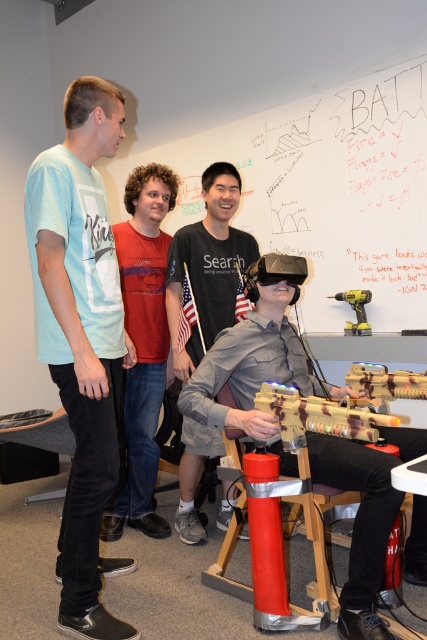
Question: Which point is closer to the camera taking this photo?

Choices:
 (A) (161, 342)
 (B) (219, 173)
 (C) (373, 429)
 (D) (90, 410)

Answer: (C)

Question: Which point is closer to the camera taking this photo?

Choices:
 (A) (148, 234)
 (B) (281, 412)
 (C) (353, 326)
 (D) (187, 237)

Answer: (B)

Question: Can you confirm if light blue t-shirt at left is thinner than red cotton shirt at center?

Choices:
 (A) no
 (B) yes

Answer: (A)

Question: Estimate the real-world distances between objects in this image. Which object is farther from the light blue t-shirt at left?

Choices:
 (A) camouflage fabric gun at center
 (B) matte gray shirt at center
 (C) metallic drill at center

Answer: (C)

Question: Is light blue t-shirt at left smaller than metallic drill at center?

Choices:
 (A) yes
 (B) no

Answer: (B)

Question: Is light blue t-shirt at left smaller than metallic drill at center?

Choices:
 (A) yes
 (B) no

Answer: (B)